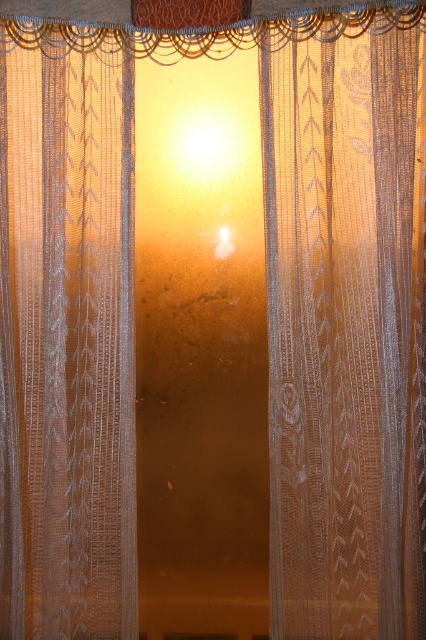
Who is taller, white lace curtain at center or white lace curtain at left?

Standing taller between the two is white lace curtain at center.

Based on the photo, is white lace curtain at center thinner than white lace curtain at left?

No.

Measure the distance between point (310, 314) and camera.

They are 1.20 meters apart.

Find the location of a particular element. white lace curtain at center is located at coordinates (345, 333).